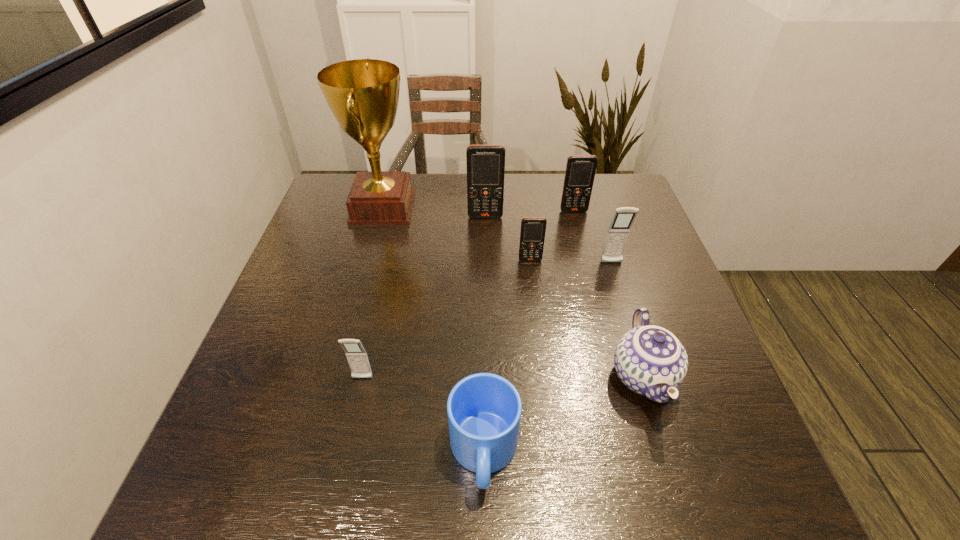
Where is `vacant space at the right edge of the desktop`? The image size is (960, 540). vacant space at the right edge of the desktop is located at coordinates (649, 283).

Find the location of a particular element. free spot at the far left corner of the desktop is located at coordinates (318, 210).

Find the location of a particular element. This screenshot has height=540, width=960. free location at the far right corner is located at coordinates (606, 184).

Image resolution: width=960 pixels, height=540 pixels. I want to click on vacant space at the near right corner, so click(675, 458).

This screenshot has height=540, width=960. In order to click on free space between the blue chinaware and the mug in this screenshot , I will do click(x=564, y=415).

The width and height of the screenshot is (960, 540). What are the coordinates of `free point between the left gray cellular telephone and the mug` in the screenshot? It's located at (423, 416).

Locate an element on the screen. The image size is (960, 540). free spot between the third cellular telephone from left to right and the leftmost cellular telephone is located at coordinates (446, 319).

The height and width of the screenshot is (540, 960). Find the location of `blank region between the award and the right gray cellular telephone`. blank region between the award and the right gray cellular telephone is located at coordinates (497, 235).

Locate an element on the screen. The width and height of the screenshot is (960, 540). vacant space that's between the blue chinaware and the farthest orange cellular telephone is located at coordinates (609, 294).

Identify the location of free spot between the right gray cellular telephone and the farthest cellular telephone. (592, 237).